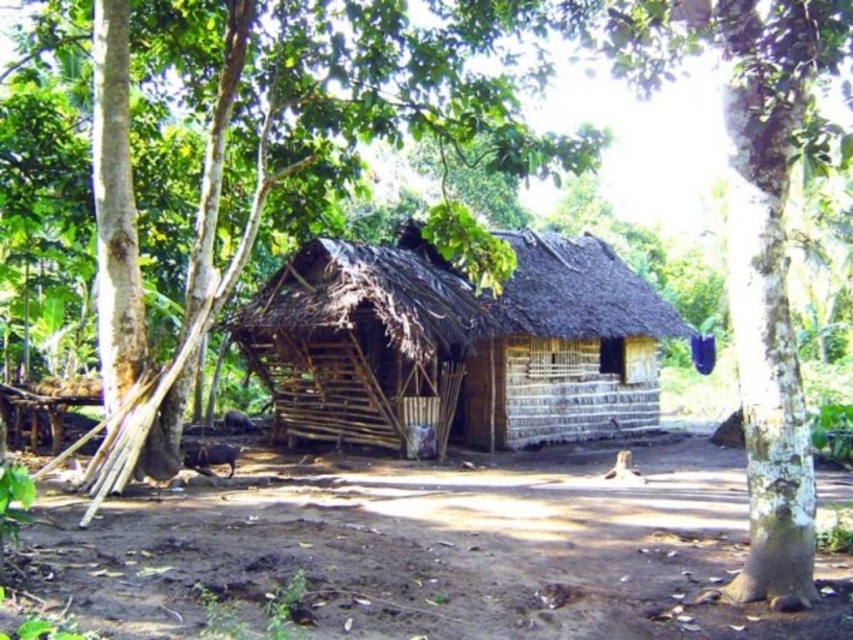
You are standing in front of the rustic traditional hut and want to take a photo of the brown wood tree at center. If your camera has a maximum focus range of 8 meters, will it be able to capture the tree clearly?

The brown wood tree at center is 7.81 meters away from the camera, which is within the 8 meters maximum focus range. Therefore, the camera can capture the tree clearly.

You are a delivery person carrying a package that requires a 3 meter clearance to deliver safely. You need to place the package between the brown wood tree at center and the wooden hut at center. Is the space between them sufficient for the package?

The distance between the brown wood tree at center and the wooden hut at center is 2.63 meters, which is less than the required 3 meters clearance. Therefore, the space is insufficient for safely placing the package.